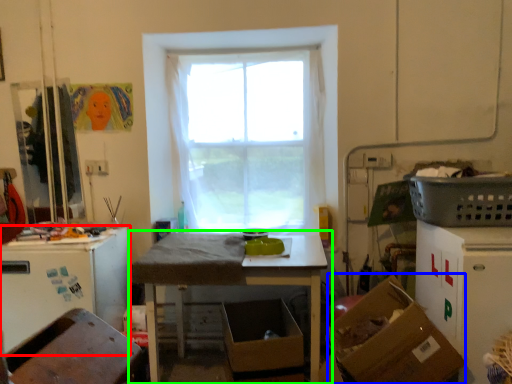
Question: Considering the real-world distances, which object is closest to leftover (highlighted by a red box)? cardboard box (highlighted by a blue box) or table (highlighted by a green box).

Choices:
 (A) cardboard box
 (B) table

Answer: (B)